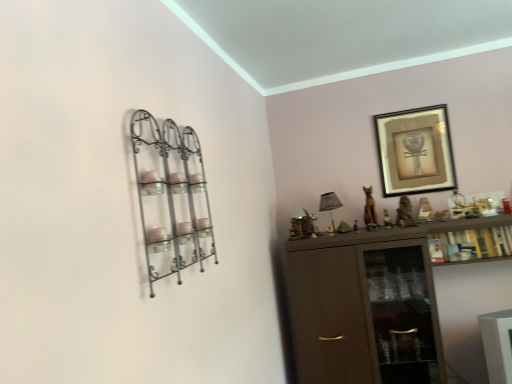
Question: Is gold-framed artwork at upper right positioned beyond the bounds of satin gray fabric lampshade at upper center?

Choices:
 (A) no
 (B) yes

Answer: (B)

Question: From the image's perspective, is gold-framed artwork at upper right below satin gray fabric lampshade at upper center?

Choices:
 (A) yes
 (B) no

Answer: (B)

Question: Considering the relative positions of gold-framed artwork at upper right and satin gray fabric lampshade at upper center in the image provided, is gold-framed artwork at upper right behind satin gray fabric lampshade at upper center?

Choices:
 (A) no
 (B) yes

Answer: (B)

Question: Is satin gray fabric lampshade at upper center at the back of gold-framed artwork at upper right?

Choices:
 (A) no
 (B) yes

Answer: (A)

Question: Considering the relative sizes of gold-framed artwork at upper right and satin gray fabric lampshade at upper center in the image provided, is gold-framed artwork at upper right shorter than satin gray fabric lampshade at upper center?

Choices:
 (A) no
 (B) yes

Answer: (A)

Question: Can you confirm if gold-framed artwork at upper right is positioned to the right of satin gray fabric lampshade at upper center?

Choices:
 (A) yes
 (B) no

Answer: (A)

Question: Is wooden cabinet at right positioned in front of satin gray fabric lampshade at upper center?

Choices:
 (A) no
 (B) yes

Answer: (B)

Question: Considering the relative sizes of wooden cabinet at right and satin gray fabric lampshade at upper center in the image provided, is wooden cabinet at right shorter than satin gray fabric lampshade at upper center?

Choices:
 (A) yes
 (B) no

Answer: (A)

Question: Is satin gray fabric lampshade at upper center completely or partially inside wooden cabinet at right?

Choices:
 (A) yes
 (B) no

Answer: (B)

Question: Is wooden cabinet at right next to satin gray fabric lampshade at upper center and touching it?

Choices:
 (A) yes
 (B) no

Answer: (B)

Question: Considering the relative positions of wooden cabinet at right and satin gray fabric lampshade at upper center in the image provided, is wooden cabinet at right to the left of satin gray fabric lampshade at upper center from the viewer's perspective?

Choices:
 (A) yes
 (B) no

Answer: (B)

Question: Can you confirm if wooden cabinet at right is bigger than satin gray fabric lampshade at upper center?

Choices:
 (A) no
 (B) yes

Answer: (B)

Question: From a real-world perspective, is metallic wire shelf at left beneath satin gray fabric lampshade at upper center?

Choices:
 (A) no
 (B) yes

Answer: (A)